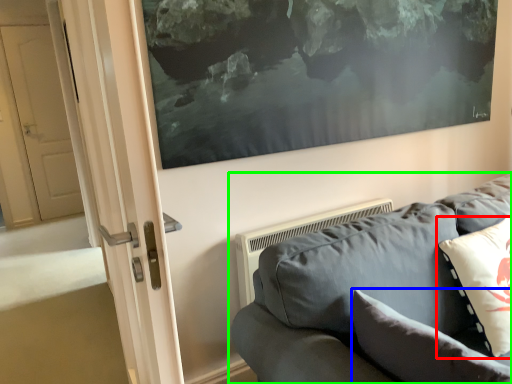
Question: Based on their relative distances, which object is nearer to pillow (highlighted by a red box)? Choose from pillow (highlighted by a blue box) and studio couch (highlighted by a green box).

Choices:
 (A) pillow
 (B) studio couch

Answer: (B)